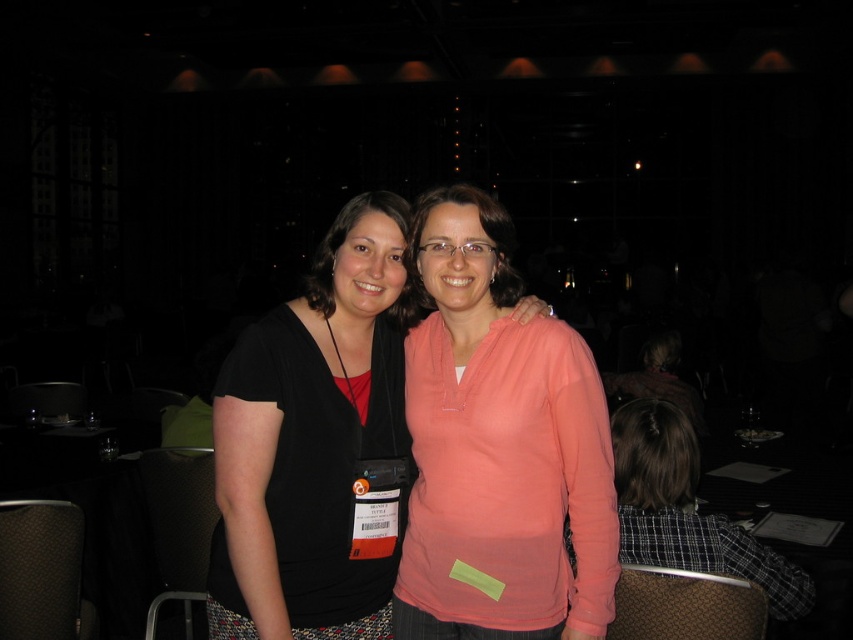
Can you confirm if matte pink hoodie at center is smaller than matte black shirt at center?

Incorrect, matte pink hoodie at center is not smaller in size than matte black shirt at center.

Can you confirm if matte pink hoodie at center is shorter than matte black shirt at center?

Indeed, matte pink hoodie at center has a lesser height compared to matte black shirt at center.

Who is more forward, (460, 577) or (264, 349)?

Point (264, 349) is more forward.

Locate an element on the screen. The height and width of the screenshot is (640, 853). matte pink hoodie at center is located at coordinates (498, 449).